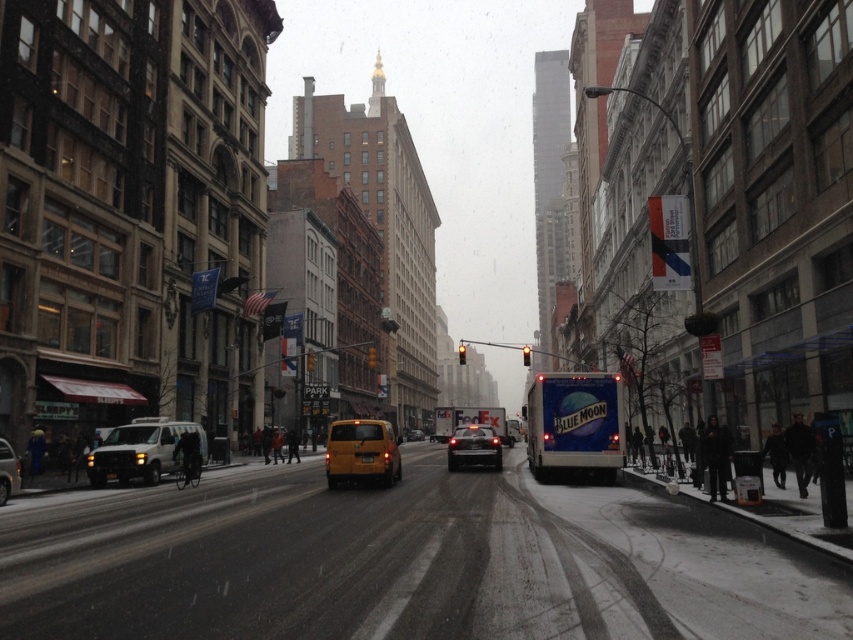
Is yellow matte taxi at center bigger than yellow matte taxi cab at center?

Indeed, yellow matte taxi at center has a larger size compared to yellow matte taxi cab at center.

Does yellow matte taxi at center appear on the right side of yellow matte taxi cab at center?

Yes, yellow matte taxi at center is to the right of yellow matte taxi cab at center.

At what (x,y) coordinates should I click in order to perform the action: click on yellow matte taxi at center. Please return your answer as a coordinate pair (x, y). Looking at the image, I should click on (361, 452).

Is shiny black sedan at center shorter than yellow matte taxi cab at center?

No.

Describe the element at coordinates (474, 448) in the screenshot. I see `shiny black sedan at center` at that location.

I want to click on shiny black sedan at center, so click(x=474, y=448).

Is shiny black sedan at center positioned before yellow matte van at center?

That is True.

Between shiny black sedan at center and yellow matte van at center, which one is positioned higher?

shiny black sedan at center

Identify the location of shiny black sedan at center. (474, 448).